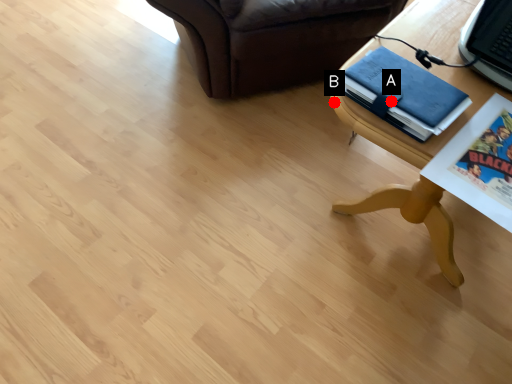
Question: Two points are circled on the image, labeled by A and B beside each circle. Among these points, which one is nearest to the camera?

Choices:
 (A) A is closer
 (B) B is closer

Answer: (A)